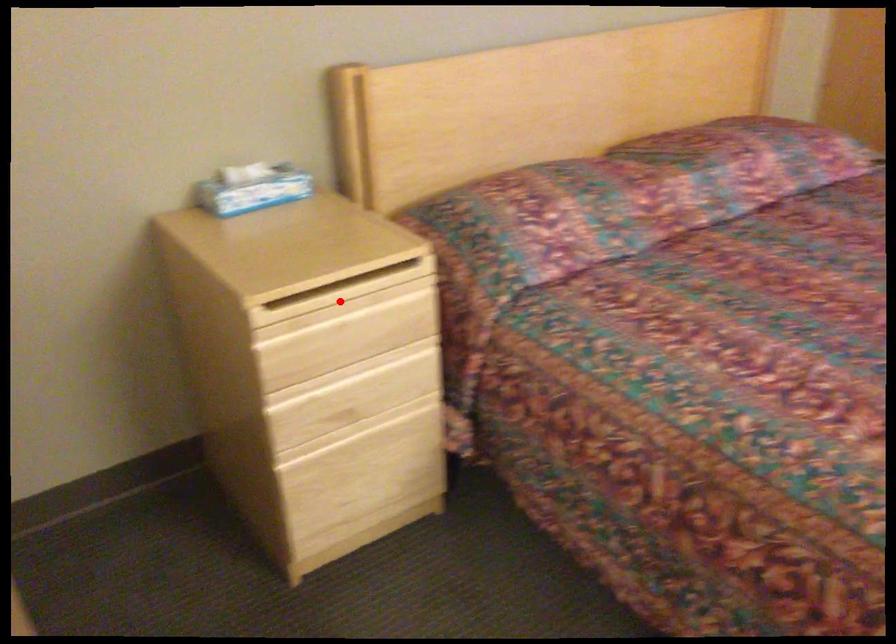
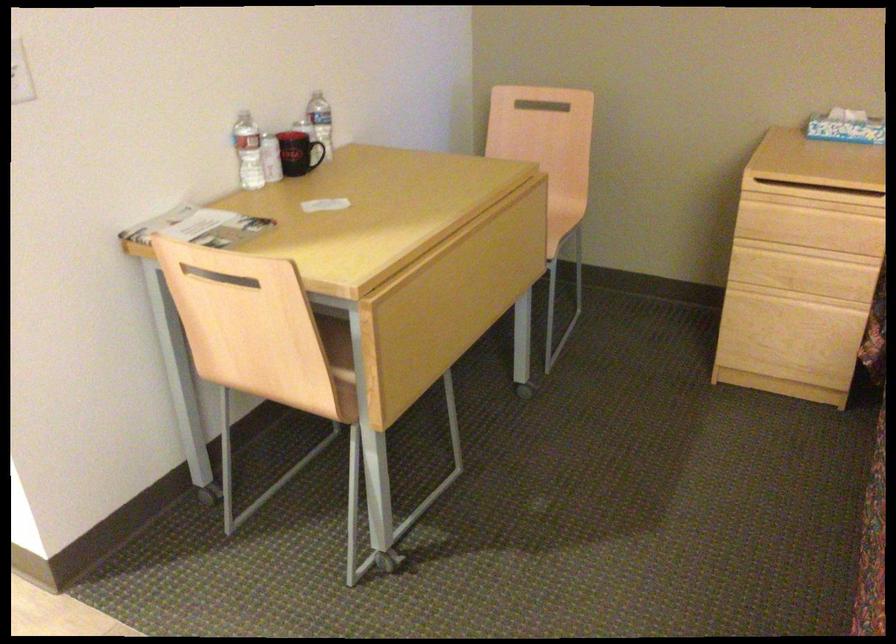
Question: I am providing you with two images of the same scene from different viewpoints. Image1 has a red point marked. In image2, the corresponding 3D location appears at what relative position? Reply with the corresponding letter.

Choices:
 (A) Closer
 (B) Farther

Answer: (B)